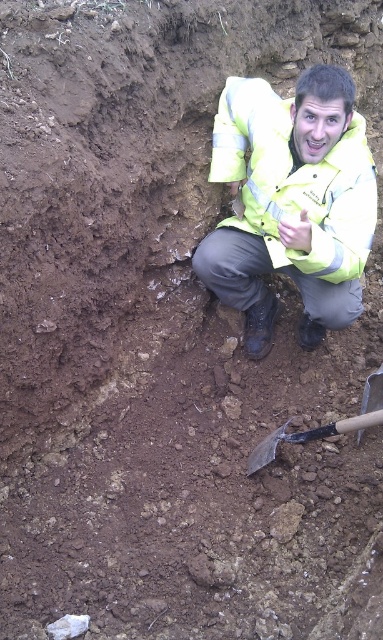
Who is positioned more to the right, yellow reflective jacket at center or wooden handle shovel at lower center?

From the viewer's perspective, wooden handle shovel at lower center appears more on the right side.

Does yellow reflective jacket at center have a greater width compared to wooden handle shovel at lower center?

Yes.

Between point (265, 308) and point (376, 422), which one is positioned in front?

Positioned in front is point (376, 422).

Where is `yellow reflective jacket at center`? yellow reflective jacket at center is located at coordinates (291, 202).